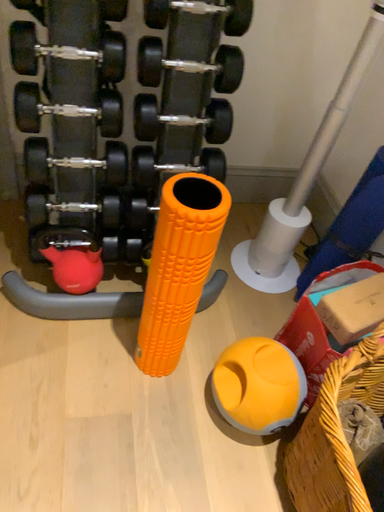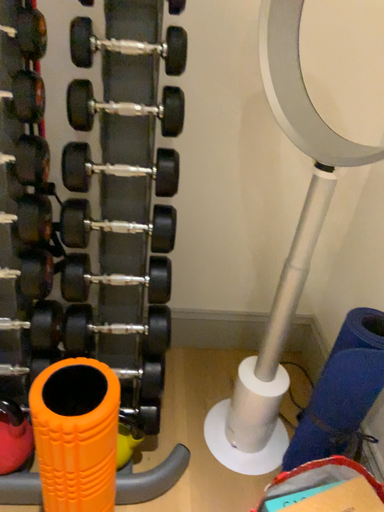
Question: How did the camera likely rotate when shooting the video?

Choices:
 (A) rotated right
 (B) rotated left

Answer: (B)